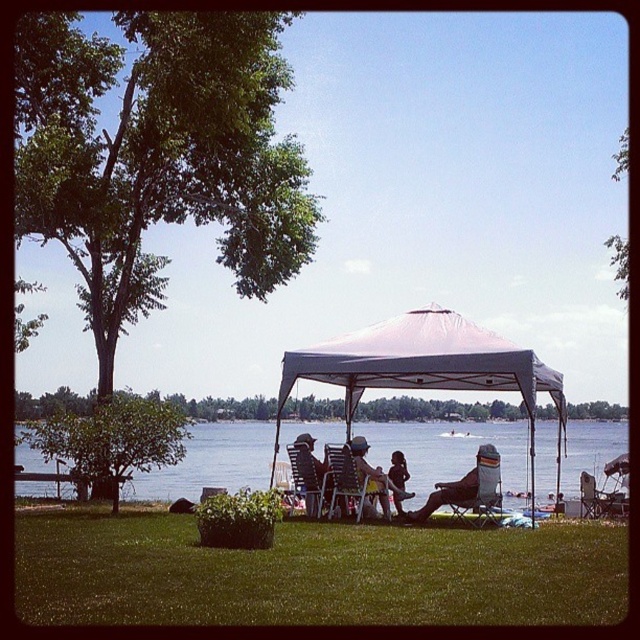
Is plastic folding chair at center behind smooth skin child at center?

No, plastic folding chair at center is in front of smooth skin child at center.

Who is more forward, (365, 504) or (397, 451)?

Point (365, 504) is more forward.

Find the location of a particular element. The height and width of the screenshot is (640, 640). plastic folding chair at center is located at coordinates (358, 481).

Does metallic gray folding chair at center have a lesser height compared to metallic silver chair at lower right?

No, metallic gray folding chair at center is not shorter than metallic silver chair at lower right.

Which is in front, point (472, 490) or point (580, 497)?

Point (472, 490)

This screenshot has height=640, width=640. Identify the location of metallic gray folding chair at center. (477, 493).

Does white fabric canopy at center appear on the left side of matte blue shorts at center?

In fact, white fabric canopy at center is to the right of matte blue shorts at center.

Who is more distant from viewer, [308,356] or [385,474]?

Positioned behind is point [385,474].

Locate an element on the screen. The height and width of the screenshot is (640, 640). white fabric canopy at center is located at coordinates (426, 368).